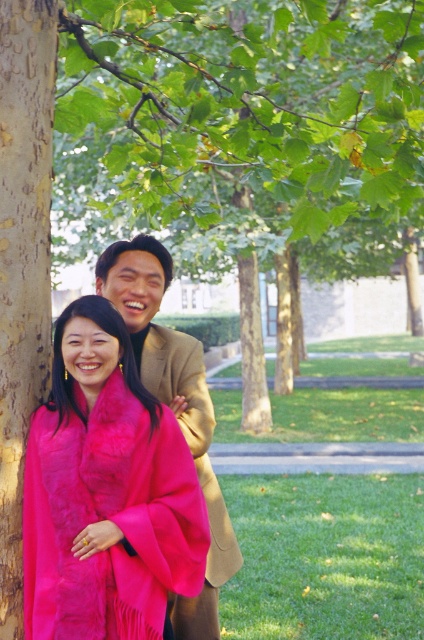
Question: Which object is the farthest from the tan wool coat at center?

Choices:
 (A) fuzzy pink scarf at left
 (B) smooth bark tree trunk at left

Answer: (B)

Question: Can you confirm if green leafy tree at center is positioned to the left of smooth bark tree trunk at left?

Choices:
 (A) yes
 (B) no

Answer: (B)

Question: Which point appears closest to the camera in this image?

Choices:
 (A) (27, 145)
 (B) (184, 406)
 (C) (88, 324)

Answer: (C)

Question: Which point is closer to the camera?

Choices:
 (A) (130, 296)
 (B) (287, 122)

Answer: (A)

Question: Is green leafy tree at center positioned at the back of fuzzy pink scarf at left?

Choices:
 (A) no
 (B) yes

Answer: (B)

Question: Is green leafy tree at center below fuzzy pink scarf at left?

Choices:
 (A) yes
 (B) no

Answer: (B)